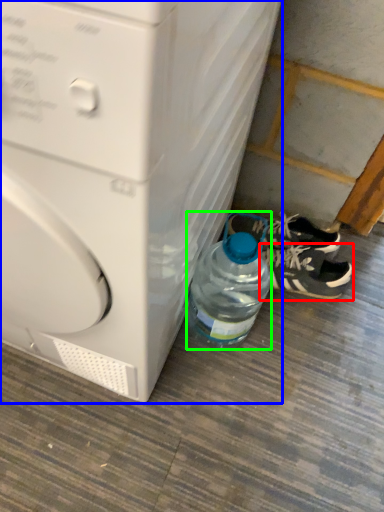
Question: Which object is positioned farthest from footwear (highlighted by a red box)? Select from washing machine (highlighted by a blue box) and bottle (highlighted by a green box).

Choices:
 (A) washing machine
 (B) bottle

Answer: (A)